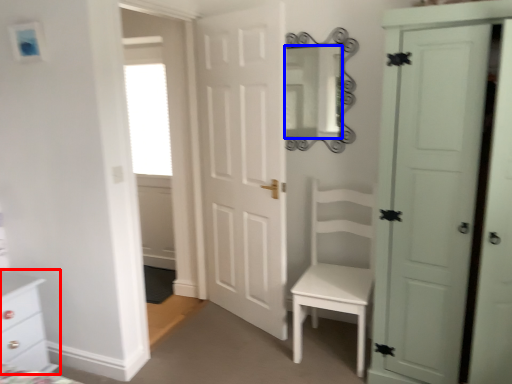
Question: Which object appears closest to the camera in this image, chest of drawers (highlighted by a red box) or mirror (highlighted by a blue box)?

Choices:
 (A) chest of drawers
 (B) mirror

Answer: (A)